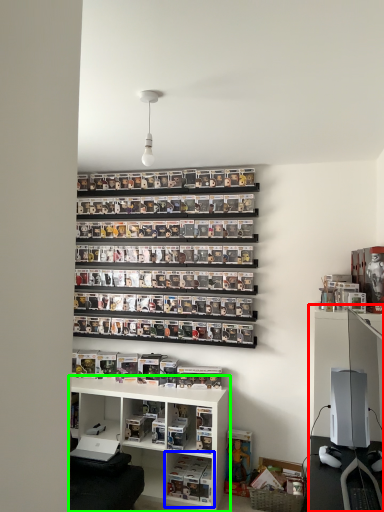
Question: Estimate the real-world distances between objects in this image. Which object is closer to entertainment center (highlighted by a red box), shelf (highlighted by a blue box) or shelf (highlighted by a green box)?

Choices:
 (A) shelf
 (B) shelf

Answer: (B)